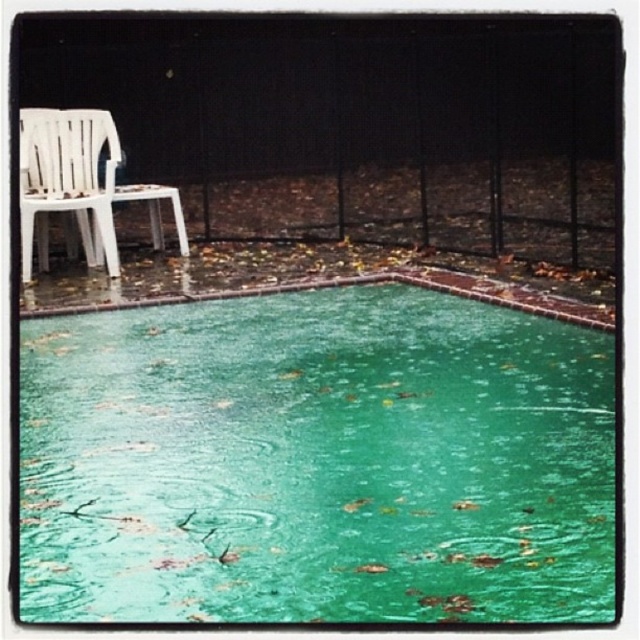
You are a painter standing at the edge of the swimming pool. You see the black metal fence at upper center and the white plastic chair at left. Which object would you need to paint a larger area of if you wanted to cover the entire surface of both objects?

The black metal fence at upper center would require painting a larger area since it is larger in size than the white plastic chair at left.

You are a lifeguard standing at the edge of the pool. You need to place a floating rescue buoy in the water. Considering the size of the green glossy water at center and the white plastic chair at left, where should you place the buoy to ensure it stays within the pool area?

The green glossy water at center has a larger size compared to the white plastic chair at left, so placing the buoy in the green glossy water at center ensures it stays within the pool area.

You are standing at the edge of the pool and want to reach the point marked at coordinates point (516, 536). Given that you can swim 4 meters in 10 seconds, how long will it take you to reach that point?

The distance between you and the point (516, 536) is 3.84 meters. Since you can swim 4 meters in 10 seconds, it will take approximately 9.6 seconds to reach the point.